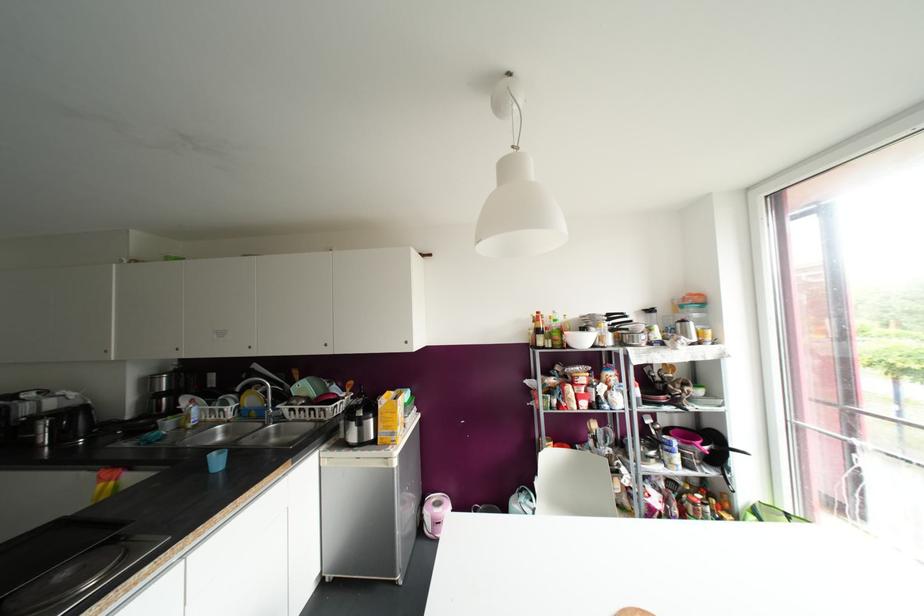
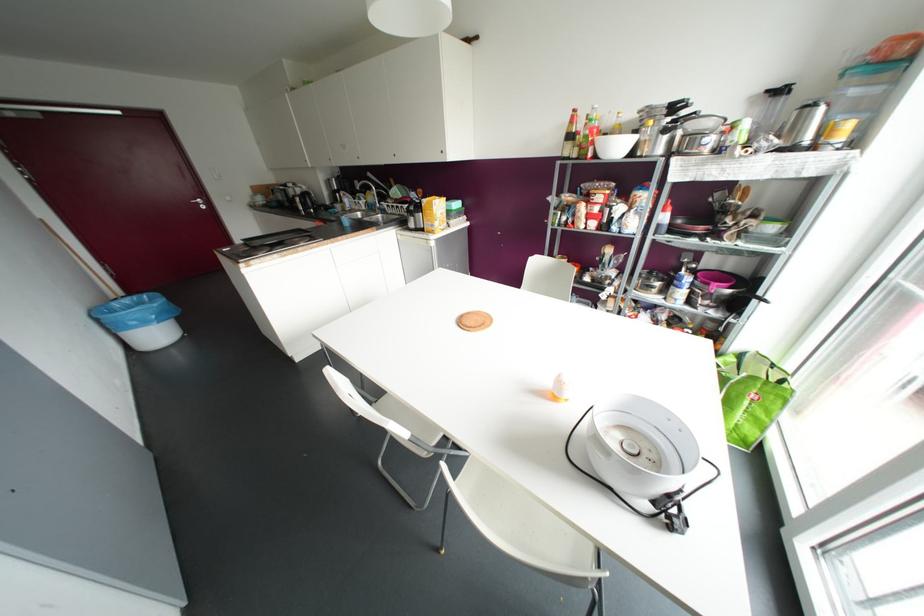
Locate, in the second image, the point that corresponds to the point at 537,312 in the first image.

(574, 110)